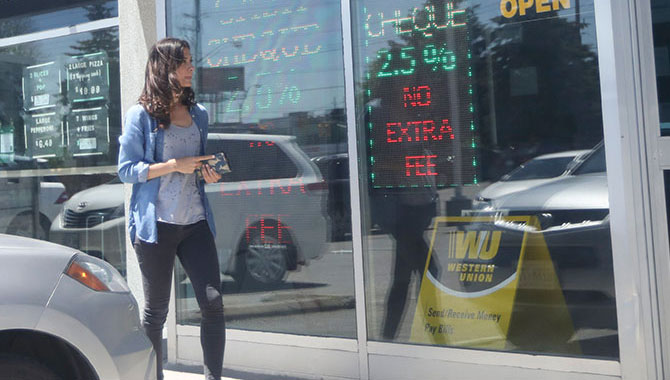
Locate an element on the screen. The image size is (670, 380). glass frame is located at coordinates pyautogui.click(x=624, y=135), pyautogui.click(x=385, y=365).